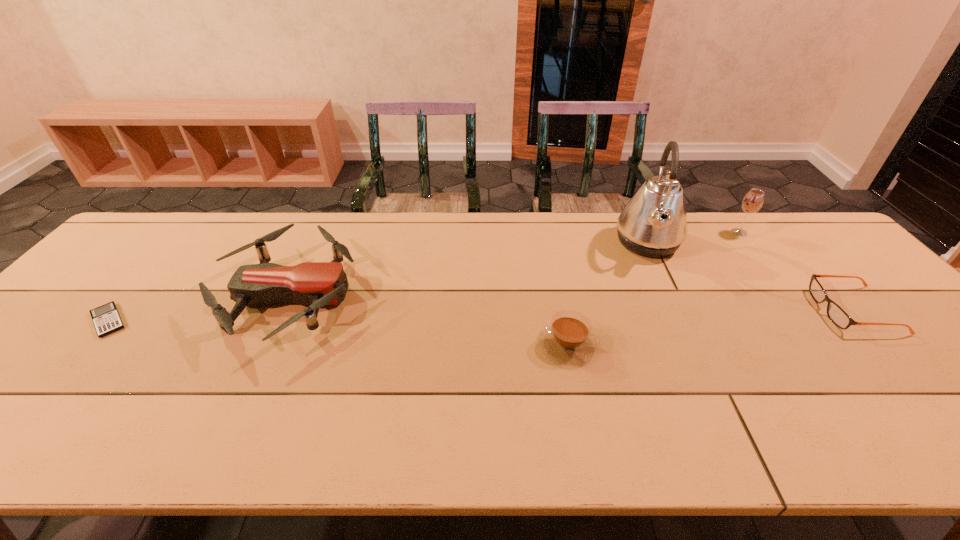
At what (x,y) coordinates should I click in order to perform the action: click on kettle. Please return your answer as a coordinate pair (x, y). Looking at the image, I should click on (653, 223).

Find the location of `the fourth object from left to right`. the fourth object from left to right is located at coordinates (653, 223).

Identify the location of the second object from right to left. This screenshot has width=960, height=540. (753, 201).

Image resolution: width=960 pixels, height=540 pixels. I want to click on wineglass, so pyautogui.click(x=753, y=201).

You are a GUI agent. You are given a task and a screenshot of the screen. Output one action in this format:
    pyautogui.click(x=<x>, y=<y>)
    Task: Click on the fifth object from right to left
    
    Given the screenshot: What is the action you would take?
    pyautogui.click(x=317, y=284)

I want to click on the third tallest object, so click(317, 284).

Identify the location of the fourth object from right to left. (568, 340).

What are the coordinates of `the third shortest object` in the screenshot? It's located at (568, 340).

At what (x,y) coordinates should I click in order to perform the action: click on the fifth tallest object. Please return your answer as a coordinate pair (x, y). This screenshot has width=960, height=540. Looking at the image, I should click on (836, 314).

The height and width of the screenshot is (540, 960). Find the location of `spectacles`. spectacles is located at coordinates (836, 314).